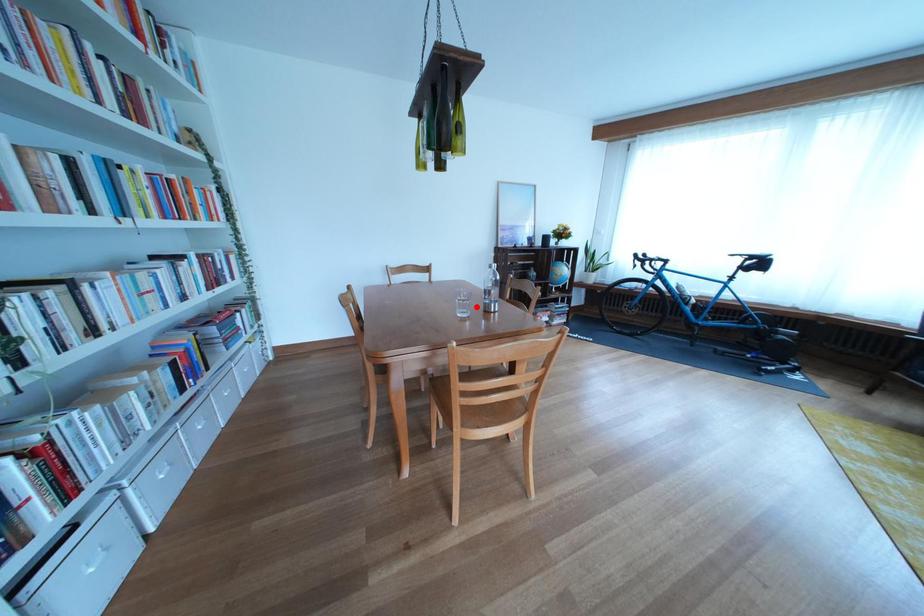
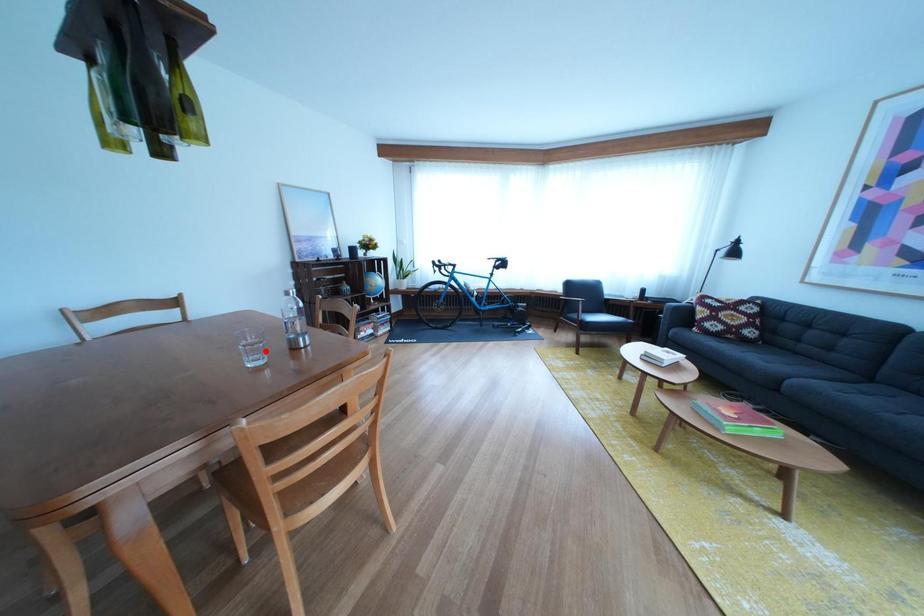
I am providing you with two images of the same scene from different viewpoints. A red point is marked on the first image and another point is marked on the second image. Does the point marked in image1 correspond to the same location as the one in image2?

Yes